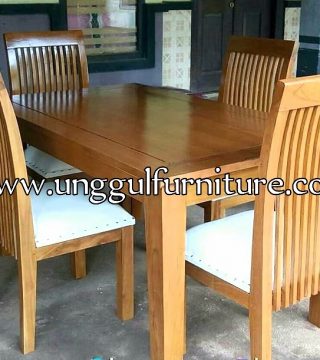
This screenshot has width=320, height=360. Find the location of `door`. door is located at coordinates (217, 31).